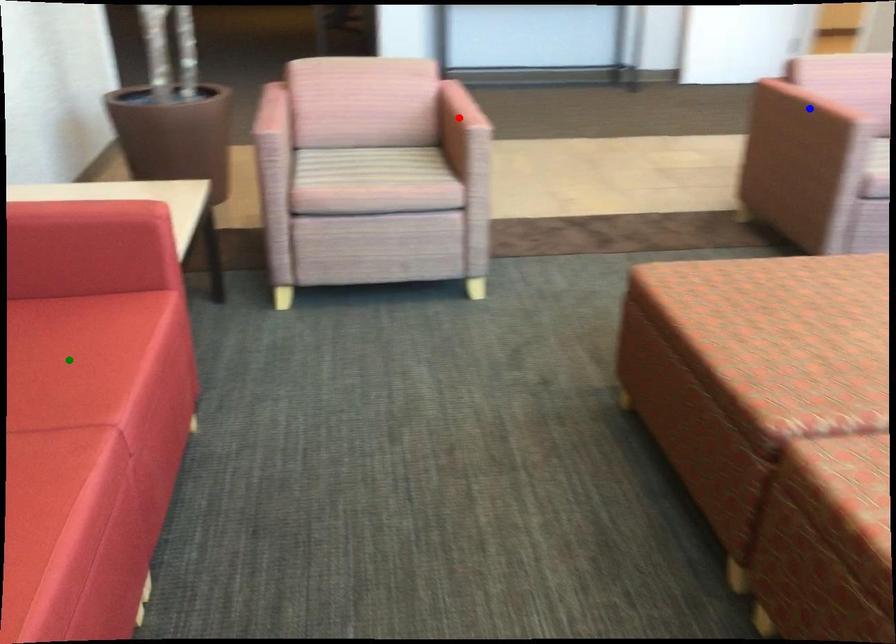
Order these from nearest to farthest:
1. blue point
2. red point
3. green point

1. green point
2. red point
3. blue point